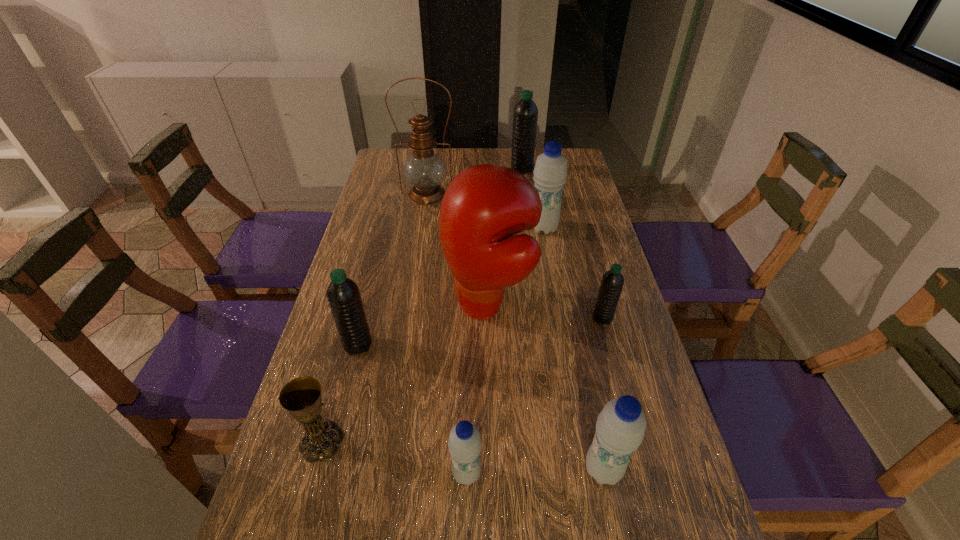
At what (x,y) coordinates should I click in order to perform the action: click on blank area located 0.170m on the front of the nearest black water bottle. Please return your answer as a coordinate pair (x, y). This screenshot has width=960, height=540. Looking at the image, I should click on (339, 421).

You are a GUI agent. You are given a task and a screenshot of the screen. Output one action in this format:
    pyautogui.click(x=<x>, y=<y>)
    Task: Click on the vacant region located on the left of the second biggest blue water bottle
    This screenshot has width=960, height=540.
    Given the screenshot: What is the action you would take?
    pyautogui.click(x=456, y=469)

What are the coordinates of `vacant space located 0.050m on the front of the rightmost water bottle` in the screenshot? It's located at (609, 341).

The height and width of the screenshot is (540, 960). Identify the location of blank space located 0.250m on the right of the smallest blue water bottle. (610, 474).

Locate an element on the screen. The width and height of the screenshot is (960, 540). vacant space situated on the back of the chalice is located at coordinates (350, 337).

This screenshot has width=960, height=540. Identify the location of object positioned at the far edge. (525, 117).

Locate an element on the screen. The image size is (960, 540). oil lamp at the left edge is located at coordinates (424, 170).

I want to click on water bottle located at the left edge, so click(343, 295).

This screenshot has width=960, height=540. I want to click on chalice that is at the left edge, so click(x=301, y=397).

Identify the location of vacant region at the left edge. The image size is (960, 540). (386, 313).